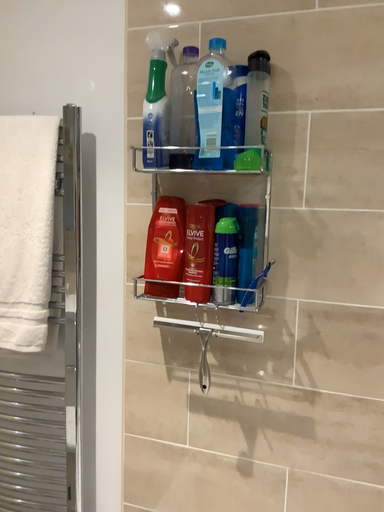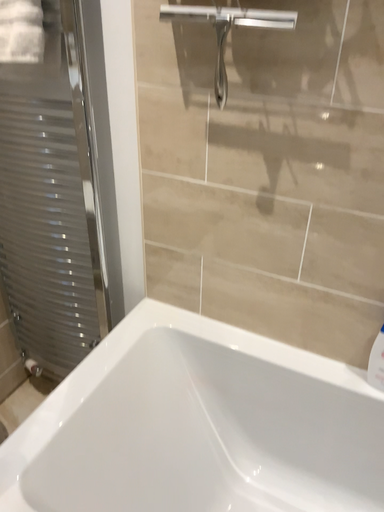
Question: How did the camera likely rotate when shooting the video?

Choices:
 (A) rotated left
 (B) rotated right

Answer: (A)